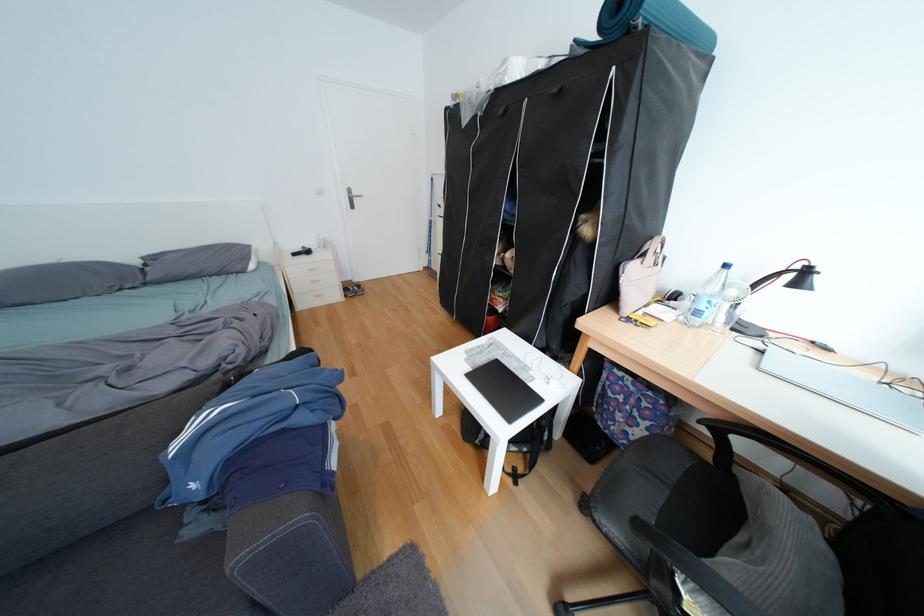
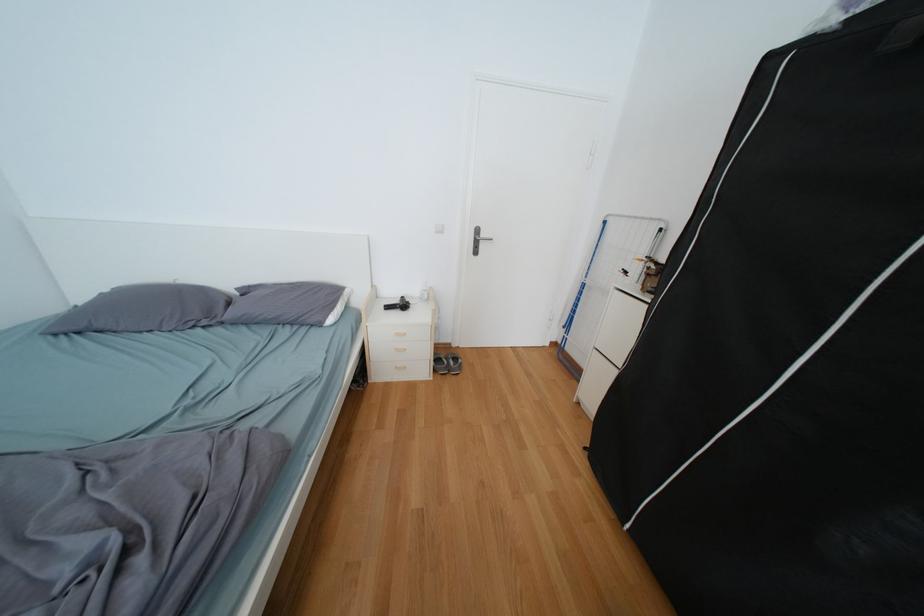
In the second image, find the point that corresponds to point (129, 288) in the first image.

(204, 323)